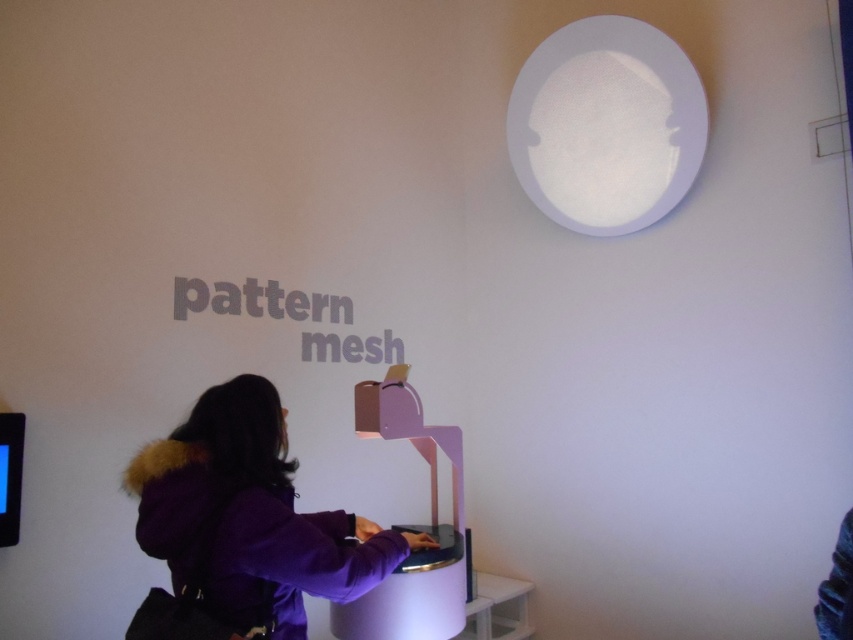
From the picture: You are a photographer standing near the camera. You want to take a photo of the purple fabric coat at center. Is the distance between you and the coat sufficient to capture a clear, full view of the coat in the photo?

The purple fabric coat at center and camera are 5.07 feet apart from each other. This distance should be sufficient to capture a clear, full view of the coat in the photo.

You are a visitor at the exhibit and want to sit down while observing the interactive display. Which object, the white plastic stool at lower center or the dark purple fabric at lower right, is more suitable for sitting?

The white plastic stool at lower center is bigger than the dark purple fabric at lower right, so it is more suitable for sitting.